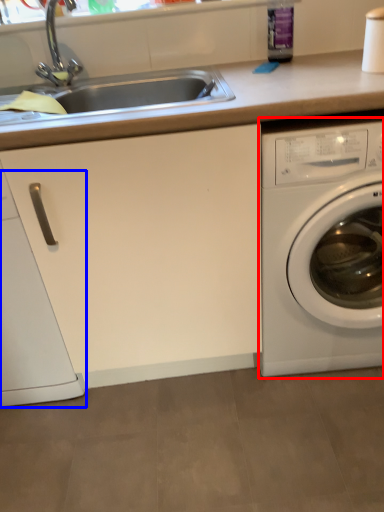
Question: Which of the following is the closest to the observer, washing machine (highlighted by a red box) or dish washer (highlighted by a blue box)?

Choices:
 (A) washing machine
 (B) dish washer

Answer: (A)